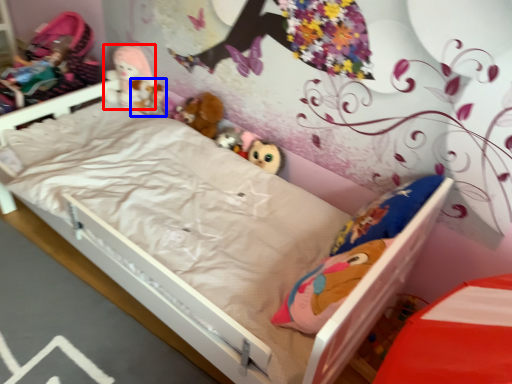
Question: Which point is further to the camera, doll (highlighted by a red box) or toy (highlighted by a blue box)?

Choices:
 (A) doll
 (B) toy

Answer: (B)